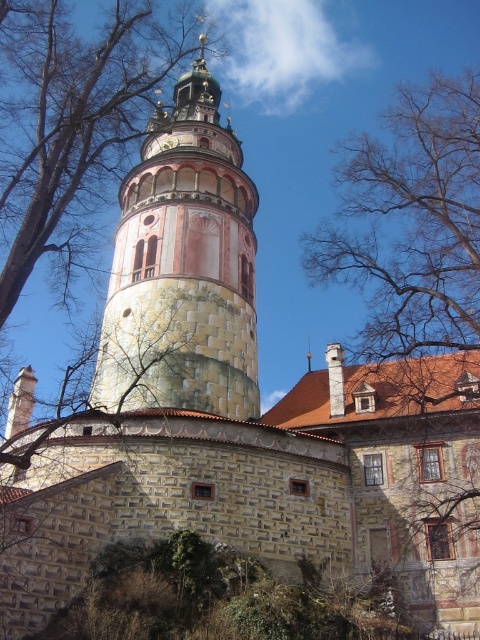
Describe the element at coordinates (182, 268) in the screenshot. I see `stone tower at center` at that location.

The image size is (480, 640). I want to click on stone tower at center, so click(182, 268).